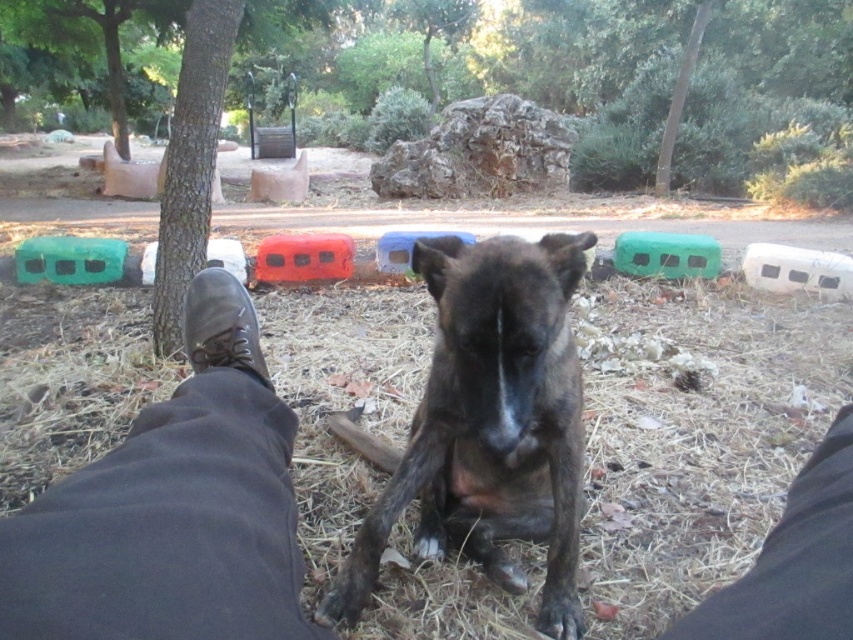
Question: Which point is closer to the camera taking this photo?

Choices:
 (A) (837, 538)
 (B) (189, 605)
 (C) (537, 456)

Answer: (B)

Question: Does brown dry hay at lower center have a greater width compared to leather shoe at lower left?

Choices:
 (A) no
 (B) yes

Answer: (A)

Question: Does black fabric pants at lower right have a larger size compared to leather boot at lower left?

Choices:
 (A) yes
 (B) no

Answer: (B)

Question: Which of the following is the closest to the observer?

Choices:
 (A) (782, 560)
 (B) (213, 298)

Answer: (A)

Question: Estimate the real-world distances between objects in this image. Which object is closer to the leather shoe at lower left?

Choices:
 (A) black fabric pants at lower right
 (B) brown rough bark tree at left
 (C) brown fur dog at center

Answer: (C)

Question: Does black fabric pants at lower right appear on the left side of leather boot at lower left?

Choices:
 (A) no
 (B) yes

Answer: (A)